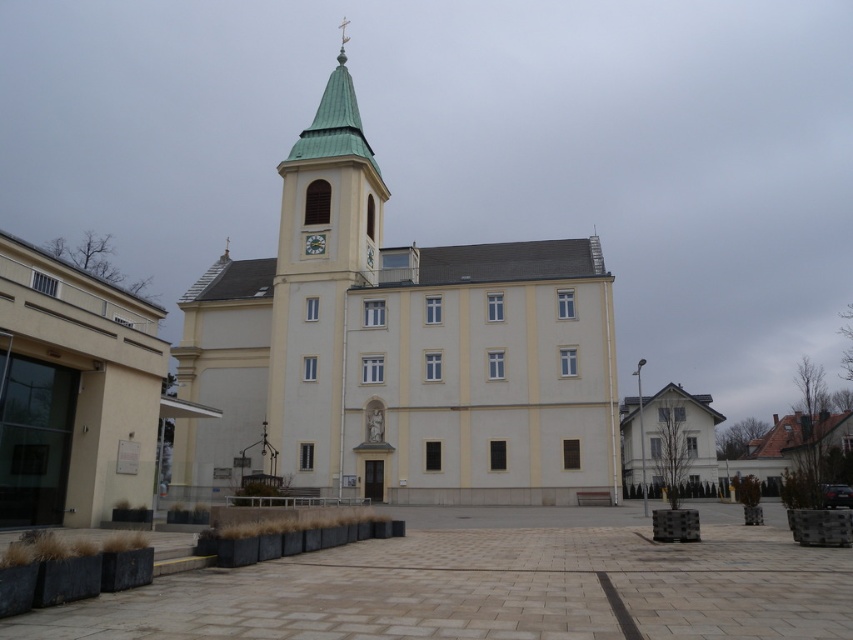
Question: Can you confirm if green matte tower at center is bigger than white glossy clock at center?

Choices:
 (A) no
 (B) yes

Answer: (B)

Question: Is green matte tower at center above white glossy clock at center?

Choices:
 (A) no
 (B) yes

Answer: (B)

Question: Which of the following is the farthest from the observer?

Choices:
 (A) (323, 396)
 (B) (322, 246)
 (C) (389, 476)

Answer: (B)

Question: Based on their relative distances, which object is farther from the green matte tower at center?

Choices:
 (A) white glossy clock at center
 (B) beige stucco church at center

Answer: (A)

Question: Is beige stucco church at center wider than green matte tower at center?

Choices:
 (A) no
 (B) yes

Answer: (B)

Question: Which object is positioned farthest from the beige stucco church at center?

Choices:
 (A) green matte tower at center
 (B) white glossy clock at center

Answer: (B)